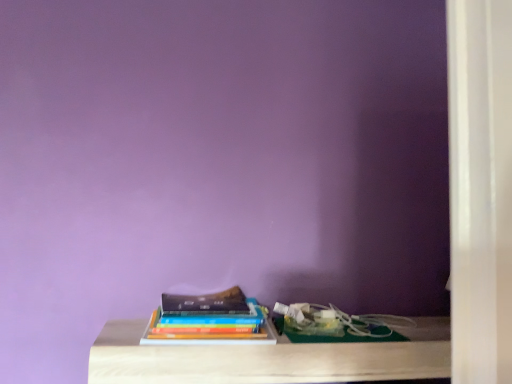
Measure the distance between point (281, 355) and camera.

A distance of 37.40 inches exists between point (281, 355) and camera.

Identify the location of light wood table at center. (270, 358).

Measure the distance between light wood table at center and camera.

light wood table at center is 34.11 inches from camera.

What do you see at coordinates (270, 358) in the screenshot? The width and height of the screenshot is (512, 384). I see `light wood table at center` at bounding box center [270, 358].

Measure the distance between hardcover books at center and camera.

The distance of hardcover books at center from camera is 90.60 centimeters.

Image resolution: width=512 pixels, height=384 pixels. Describe the element at coordinates (204, 334) in the screenshot. I see `hardcover books at center` at that location.

This screenshot has height=384, width=512. Find the location of `hardcover books at center`. hardcover books at center is located at coordinates (204, 334).

Measure the distance between point (239, 329) and camera.

Point (239, 329) and camera are 38.23 inches apart.

Where is `light wood table at center`? The image size is (512, 384). light wood table at center is located at coordinates (270, 358).

Between hardcover books at center and light wood table at center, which one appears on the left side from the viewer's perspective?

Result: hardcover books at center.

Looking at this image, considering their positions, is hardcover books at center located in front of or behind light wood table at center?

Clearly, hardcover books at center is behind light wood table at center.

Does point (153, 337) come closer to viewer compared to point (436, 376)?

Yes, point (153, 337) is in front of point (436, 376).

From the image's perspective, which object appears higher, hardcover books at center or light wood table at center?

From the image's view, hardcover books at center is above.

From a real-world perspective, is hardcover books at center physically above light wood table at center?

Indeed, from a real-world perspective, hardcover books at center stands above light wood table at center.

Between hardcover books at center and light wood table at center, which one has larger width?

light wood table at center.

Between hardcover books at center and light wood table at center, which one has more height?

hardcover books at center.

Considering the sizes of objects hardcover books at center and light wood table at center in the image provided, who is smaller, hardcover books at center or light wood table at center?

hardcover books at center.

In the scene shown: Is hardcover books at center inside the boundaries of light wood table at center, or outside?

hardcover books at center lies outside light wood table at center.

Would you say hardcover books at center is a long distance from light wood table at center?

No, hardcover books at center is not far away from light wood table at center.

Is hardcover books at center facing away from light wood table at center?

hardcover books at center is not turned away from light wood table at center.

How many degrees apart are the facing directions of hardcover books at center and light wood table at center?

The angle between the facing direction of hardcover books at center and the facing direction of light wood table at center is 0.351 degrees.

Find the location of a particular element. table that is on the right side of hardcover books at center is located at coordinates (270, 358).

Which object is positioned more to the right, light wood table at center or hardcover books at center?

light wood table at center.

Is light wood table at center positioned in front of hardcover books at center?

Yes, light wood table at center is closer to the viewer.

Does point (415, 319) come in front of point (213, 335)?

No, (415, 319) is further to viewer.

Looking at this image, from the image's perspective, relative to hardcover books at center, is light wood table at center above or below?

light wood table at center is situated lower than hardcover books at center in the image.

From a real-world perspective, is light wood table at center physically located above or below hardcover books at center?

In terms of real-world spatial position, light wood table at center is below hardcover books at center.

Does light wood table at center have a greater width compared to hardcover books at center?

Yes.

Which of these two, light wood table at center or hardcover books at center, stands shorter?

light wood table at center is shorter.

Considering the sizes of objects light wood table at center and hardcover books at center in the image provided, who is bigger, light wood table at center or hardcover books at center?

Bigger between the two is light wood table at center.

Is hardcover books at center inside light wood table at center?

No, hardcover books at center is not inside light wood table at center.

Is light wood table at center not close to hardcover books at center?

Actually, light wood table at center and hardcover books at center are a little close together.

Is light wood table at center facing away from hardcover books at center?

light wood table at center is not turned away from hardcover books at center.

You are a GUI agent. You are given a task and a screenshot of the screen. Output one action in this format:
    pyautogui.click(x=<x>, y=<y>)
    Task: Click on the table in front of the hardcover books at center
    The image size is (512, 384).
    Given the screenshot: What is the action you would take?
    pyautogui.click(x=270, y=358)

The width and height of the screenshot is (512, 384). I want to click on book above the light wood table at center (from the image's perspective), so click(x=204, y=334).

The height and width of the screenshot is (384, 512). I want to click on table in front of the hardcover books at center, so click(270, 358).